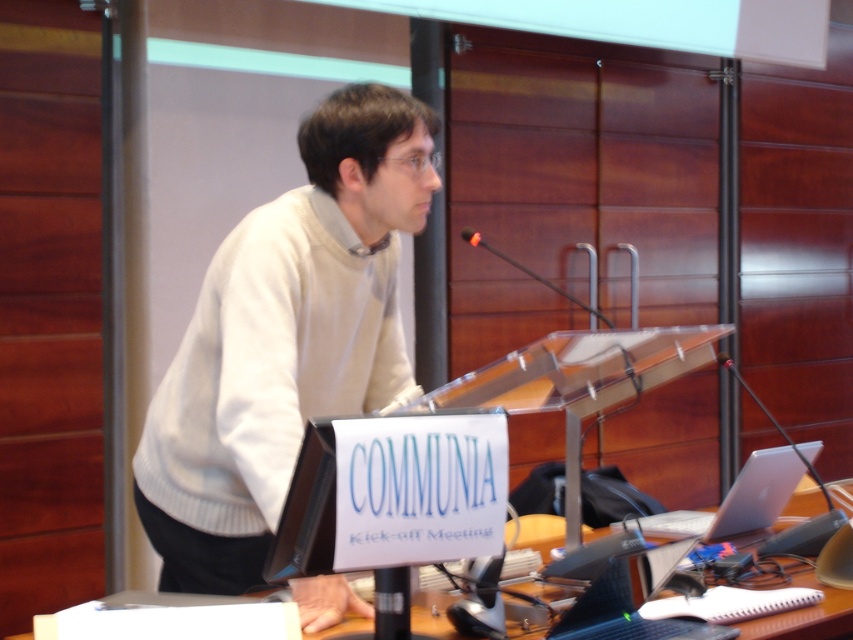
Question: Considering the relative positions of white knitted sweater at center and black glossy laptop at lower center in the image provided, where is white knitted sweater at center located with respect to black glossy laptop at lower center?

Choices:
 (A) below
 (B) above

Answer: (B)

Question: In this image, where is silver metallic laptop at lower right located relative to black glossy laptop at lower center?

Choices:
 (A) below
 (B) above

Answer: (B)

Question: Does white knitted sweater at center come in front of silver metallic laptop at lower right?

Choices:
 (A) yes
 (B) no

Answer: (A)

Question: Which point is closer to the camera taking this photo?

Choices:
 (A) (773, 467)
 (B) (421, 624)

Answer: (B)

Question: Which of the following is the farthest from the observer?

Choices:
 (A) wooden table at center
 (B) black glossy laptop at lower center
 (C) silver metallic laptop at lower right

Answer: (C)

Question: Which point appears closest to the camera in this image?

Choices:
 (A) (804, 577)
 (B) (575, 637)
 (C) (657, 518)

Answer: (B)